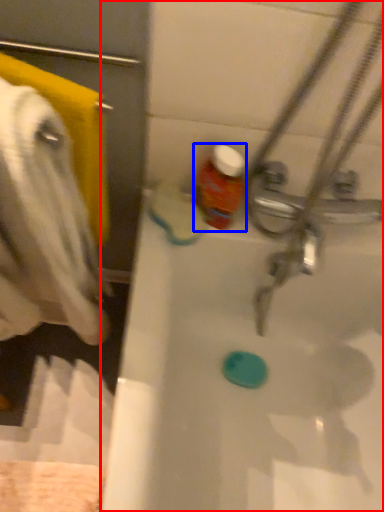
Question: Which point is closer to the camera, bathtub (highlighted by a red box) or bottle (highlighted by a blue box)?

Choices:
 (A) bathtub
 (B) bottle

Answer: (A)